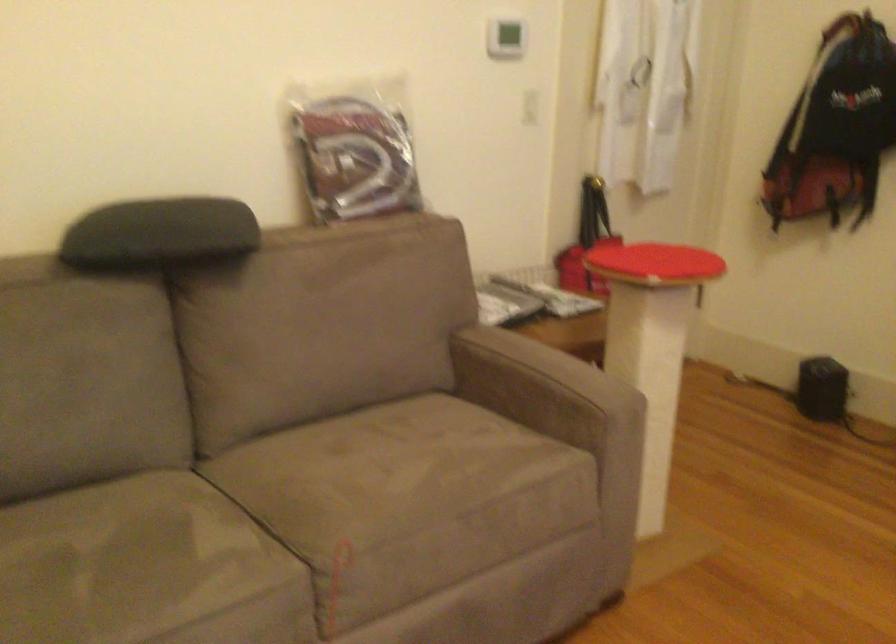
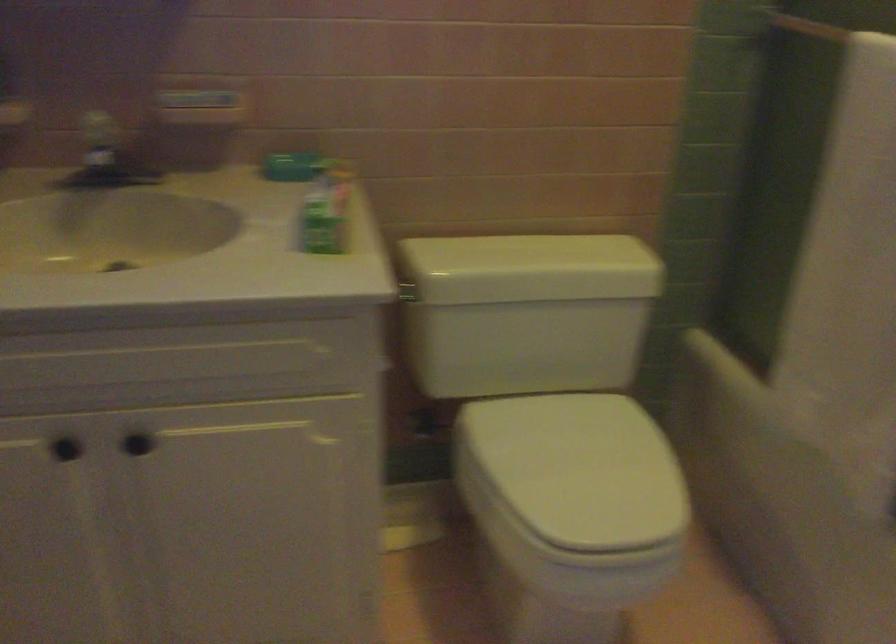
The images are taken continuously from a first-person perspective. In which direction are you moving?

The cameraman walked toward left, backward.